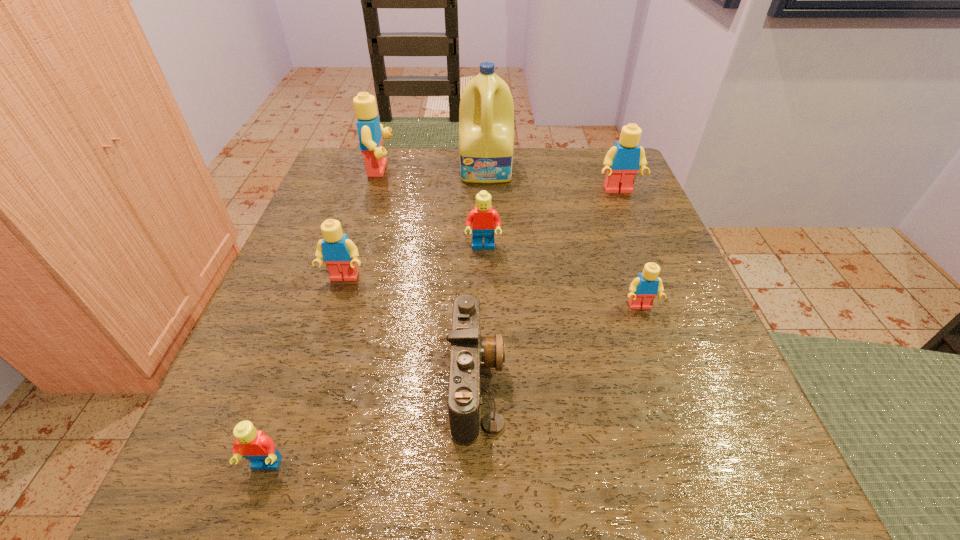
Image resolution: width=960 pixels, height=540 pixels. I want to click on free location at the far left corner of the desktop, so click(x=347, y=179).

The width and height of the screenshot is (960, 540). Find the location of `vacant space at the far right corner of the desktop`. vacant space at the far right corner of the desktop is located at coordinates (615, 199).

The height and width of the screenshot is (540, 960). In order to click on empty space that is in between the tallest object and the seventh farthest object in this screenshot , I will do `click(482, 276)`.

Find the location of a particular element. This screenshot has width=960, height=540. free space that is in between the tallest Lego and the detergent is located at coordinates (434, 170).

Where is `vacant space that's between the smaller red Lego and the second smallest yellow Lego`? vacant space that's between the smaller red Lego and the second smallest yellow Lego is located at coordinates (305, 372).

Find the location of a particular element. This screenshot has width=960, height=540. vacant area that lies between the second nearest Lego and the fourth farthest object is located at coordinates (562, 277).

The image size is (960, 540). In order to click on free space between the seventh shortest object and the tallest object in this screenshot , I will do `click(434, 170)`.

Where is `blank region between the tallest object and the camera`? The width and height of the screenshot is (960, 540). blank region between the tallest object and the camera is located at coordinates (482, 276).

The image size is (960, 540). Find the location of `vacant area that lies between the nearest yellow Lego and the second tallest object`. vacant area that lies between the nearest yellow Lego and the second tallest object is located at coordinates (510, 238).

Locate an element on the screen. vacant area that lies between the nearest yellow Lego and the fourth farthest Lego is located at coordinates (492, 293).